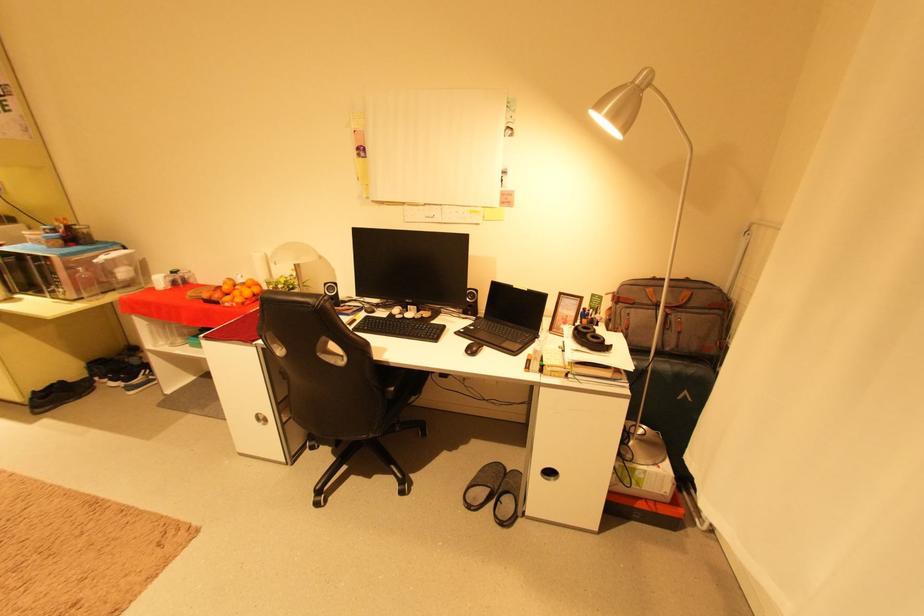
The height and width of the screenshot is (616, 924). What are the coordinates of `silver lamp head` in the screenshot? It's located at (622, 103).